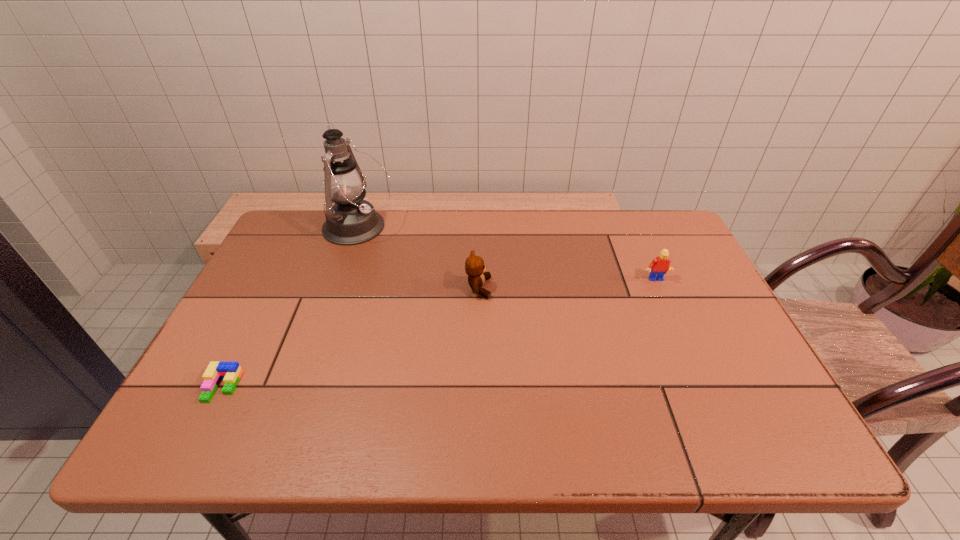
In order to click on the tallest object in this screenshot , I will do `click(351, 220)`.

The height and width of the screenshot is (540, 960). Find the location of `the farthest object`. the farthest object is located at coordinates (351, 220).

Locate an element on the screen. The height and width of the screenshot is (540, 960). teddy bear is located at coordinates (474, 265).

You are a GUI agent. You are given a task and a screenshot of the screen. Output one action in this format:
    pyautogui.click(x=<x>, y=<y>)
    Task: Click on the taller Lego
    The image size is (960, 540).
    Given the screenshot: What is the action you would take?
    pyautogui.click(x=659, y=266)

At what (x,y) coordinates should I click in order to perform the action: click on the rightmost object. Please return your answer as a coordinate pair (x, y). This screenshot has height=540, width=960. Looking at the image, I should click on (659, 266).

Find the location of a particular element. The height and width of the screenshot is (540, 960). the shortest object is located at coordinates (230, 372).

Where is `the nearer Lego`? This screenshot has width=960, height=540. the nearer Lego is located at coordinates (x=230, y=372).

This screenshot has width=960, height=540. In order to click on free space located on the front of the tallest object in this screenshot , I will do `click(347, 263)`.

Find the location of a particular element. free space located 0.160m on the front-facing side of the teddy bear is located at coordinates pyautogui.click(x=550, y=288).

Find the location of `free space located 0.300m on the front-facing side of the rightmost object`. free space located 0.300m on the front-facing side of the rightmost object is located at coordinates (696, 375).